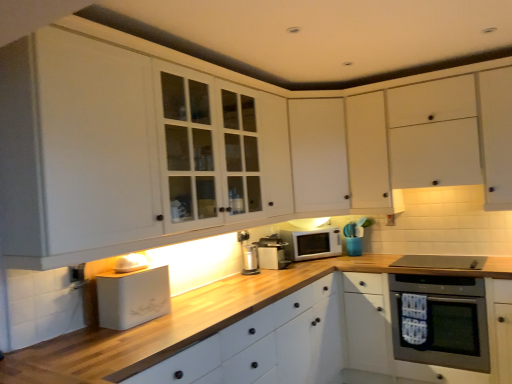
What is the approximate width of wooden at lower center?

It is 2.87 meters.

How much space does white matte cabinet at upper center, the third cabinetry in the front-to-back sequence, occupy vertically?

1.03 meters.

In the scene shown: How much space does white matte cabinet at upper right, the second cabinetry positioned from the front, occupy vertically?

white matte cabinet at upper right, the second cabinetry positioned from the front, is 3.31 feet in height.

This screenshot has width=512, height=384. Describe the element at coordinates (440, 321) in the screenshot. I see `stainless steel oven at lower right` at that location.

At what (x,y) coordinates should I click in order to perform the action: click on wooden at lower center. Please return your answer as a coordinate pair (x, y). The height and width of the screenshot is (384, 512). Looking at the image, I should click on click(x=190, y=322).

Where is `the 2nd cabinetry counting from the right of the white glossy microwave at center`? The image size is (512, 384). the 2nd cabinetry counting from the right of the white glossy microwave at center is located at coordinates (432, 137).

What's the angular difference between white matte cabinet at upper right, the 2th cabinetry when ordered from back to front, and white glossy microwave at center's facing directions?

55.6 degrees.

Which point is more forward, [482,148] or [295,232]?

Positioned in front is point [482,148].

Considering the relative sizes of white matte cabinet at upper right, the 2th cabinetry when ordered from back to front, and white glossy microwave at center in the image provided, is white matte cabinet at upper right, the 2th cabinetry when ordered from back to front, bigger than white glossy microwave at center?

Indeed, white matte cabinet at upper right, the 2th cabinetry when ordered from back to front, has a larger size compared to white glossy microwave at center.

Based on the photo, based on their sizes in the image, would you say wooden at lower center is bigger or smaller than matte gray oven at lower right?

wooden at lower center is bigger than matte gray oven at lower right.

How far apart are wooden at lower center and matte gray oven at lower right?

The distance of wooden at lower center from matte gray oven at lower right is 85.75 centimeters.

From a real-world perspective, is wooden at lower center above or below matte gray oven at lower right?

Clearly, from a real-world perspective, wooden at lower center is below matte gray oven at lower right.

From the image's perspective, which is above, wooden at lower center or matte gray oven at lower right?

matte gray oven at lower right, from the image's perspective.

From the picture: Can you confirm if stainless steel oven at lower right is positioned to the left of white matte cabinet at center, the third cabinetry when ordered from back to front?

Incorrect, stainless steel oven at lower right is not on the left side of white matte cabinet at center, the third cabinetry when ordered from back to front.

Can white matte cabinet at center, the 1th cabinetry in the front-to-back sequence, be found inside stainless steel oven at lower right?

Actually, white matte cabinet at center, the 1th cabinetry in the front-to-back sequence, is outside stainless steel oven at lower right.

Considering the relative sizes of stainless steel oven at lower right and white matte cabinet at center, the third cabinetry when ordered from back to front, in the image provided, is stainless steel oven at lower right taller than white matte cabinet at center, the third cabinetry when ordered from back to front,?

No.

Considering the points (473, 336) and (13, 124), which point is in front, point (473, 336) or point (13, 124)?

The point (13, 124) is closer.

From a real-world perspective, relative to white matte cabinet at upper right, the 2th cabinetry when ordered from back to front, is white glossy microwave at center vertically above or below?

Clearly, from a real-world perspective, white glossy microwave at center is below white matte cabinet at upper right, the 2th cabinetry when ordered from back to front.

Where is `cabinetry that is the 2nd one when counting forward from the white glossy microwave at center`? The height and width of the screenshot is (384, 512). cabinetry that is the 2nd one when counting forward from the white glossy microwave at center is located at coordinates (432, 137).

Is white glossy microwave at center next to white matte cabinet at upper right, the second cabinetry positioned from the front?

white glossy microwave at center and white matte cabinet at upper right, the second cabinetry positioned from the front, are not in contact.

Is white glossy microwave at center turned away from white matte cabinet at upper right, the 2th cabinetry when ordered from back to front?

No, white glossy microwave at center is not facing away from white matte cabinet at upper right, the 2th cabinetry when ordered from back to front.

Looking at the image, does white matte cabinet at upper center, the 1th cabinetry viewed from the back, seem bigger or smaller compared to satin silver toaster at center, the first appliance in the right-to-left sequence?

Considering their sizes, white matte cabinet at upper center, the 1th cabinetry viewed from the back, takes up more space than satin silver toaster at center, the first appliance in the right-to-left sequence.

Based on the photo, which object is wider, white matte cabinet at upper center, the 1th cabinetry viewed from the back, or satin silver toaster at center, the first appliance in the right-to-left sequence?

With larger width is white matte cabinet at upper center, the 1th cabinetry viewed from the back.

Is white matte cabinet at upper center, the third cabinetry in the front-to-back sequence, placed right next to satin silver toaster at center, the 3th appliance when ordered from left to right?

white matte cabinet at upper center, the third cabinetry in the front-to-back sequence, is not next to satin silver toaster at center, the 3th appliance when ordered from left to right, and they're not touching.

From the image's perspective, is white matte cabinet at upper right, the second cabinetry positioned from the front, above or below wooden at lower center?

Clearly, from the image's perspective, white matte cabinet at upper right, the second cabinetry positioned from the front, is above wooden at lower center.

From the picture: Is white matte cabinet at upper right, the second cabinetry positioned from the front, located outside wooden at lower center?

Yes, white matte cabinet at upper right, the second cabinetry positioned from the front, is outside of wooden at lower center.

Looking at the image, does white matte cabinet at upper right, the second cabinetry positioned from the front, seem bigger or smaller compared to wooden at lower center?

In the image, white matte cabinet at upper right, the second cabinetry positioned from the front, appears to be smaller than wooden at lower center.

In order to click on countertop that appears on the left of white matte cabinet at upper right, the second cabinetry positioned from the front in this screenshot , I will do `click(190, 322)`.

Does white glossy microwave at center lie behind satin silver thermos at lower center, the 2th appliance viewed from the left?

Yes, the depth of white glossy microwave at center is greater than that of satin silver thermos at lower center, the 2th appliance viewed from the left.

Which is more to the left, white glossy microwave at center or satin silver thermos at lower center, marked as the 2th appliance in a front-to-back arrangement?

satin silver thermos at lower center, marked as the 2th appliance in a front-to-back arrangement, is more to the left.

What's the angular difference between white glossy microwave at center and satin silver thermos at lower center, positioned as the second appliance in back-to-front order,'s facing directions?

The facing directions of white glossy microwave at center and satin silver thermos at lower center, positioned as the second appliance in back-to-front order, are 31.6 degrees apart.

There is a satin silver thermos at lower center, the 2th appliance viewed from the left. At what (x,y) coordinates should I click in order to perform the action: click on microwave oven above it (from a real-world perspective). Please return your answer as a coordinate pair (x, y). Looking at the image, I should click on (312, 244).

This screenshot has height=384, width=512. What are the coordinates of `the 3rd cabinetry above when counting from the white glossy microwave at center (from the image's perspective)` in the screenshot? It's located at (432, 137).

Where is `home appliance on the right of wooden at lower center`? home appliance on the right of wooden at lower center is located at coordinates (440, 262).

Looking at this image, which object lies further to the anchor point satin silver toaster at center, which is the third appliance from front to back, stainless steel oven at lower right or white glossy microwave at center?

stainless steel oven at lower right is further to satin silver toaster at center, which is the third appliance from front to back.

Based on their spatial positions, is white matte cabinet at center, the third cabinetry when ordered from back to front, or white matte drawer at lower center closer to stainless steel oven at lower right?

white matte drawer at lower center lies closer to stainless steel oven at lower right than the other object.

In the scene shown: When comparing their distances from satin silver toaster at center, which is the 1th appliance from back to front, does white matte bread bin at lower left, the first appliance from the left, or satin silver thermos at lower center, marked as the 2th appliance in a right-to-left arrangement, seem further?

white matte bread bin at lower left, the first appliance from the left, is positioned further to the anchor satin silver toaster at center, which is the 1th appliance from back to front.

Based on their spatial positions, is stainless steel oven at lower right or white matte drawer at lower center closer to white matte bread bin at lower left, arranged as the 1th appliance when viewed from the front?

Based on the image, white matte drawer at lower center appears to be nearer to white matte bread bin at lower left, arranged as the 1th appliance when viewed from the front.

Which object lies nearer to the anchor point white glossy microwave at center, white matte cabinet at center, the 1th cabinetry in the front-to-back sequence, or stainless steel oven at lower right?

stainless steel oven at lower right is positioned closer to the anchor white glossy microwave at center.

Based on their spatial positions, is white plastic electric outlet at lower left or matte gray oven at lower right closer to satin silver toaster at center, which is the 1th appliance from back to front?

Based on the image, matte gray oven at lower right appears to be nearer to satin silver toaster at center, which is the 1th appliance from back to front.

Considering their positions, is white matte cabinet at center, the third cabinetry when ordered from back to front, positioned closer to white matte bread bin at lower left, the first appliance from the left, than satin silver thermos at lower center, positioned as the second appliance in back-to-front order?

Based on the image, white matte cabinet at center, the third cabinetry when ordered from back to front, appears to be nearer to white matte bread bin at lower left, the first appliance from the left.

Based on their spatial positions, is white plastic electric outlet at lower left or satin silver thermos at lower center, marked as the 2th appliance in a right-to-left arrangement, further from white matte cabinet at center, the 1th cabinetry in the front-to-back sequence?

white plastic electric outlet at lower left is positioned further to the anchor white matte cabinet at center, the 1th cabinetry in the front-to-back sequence.

At what (x,y) coordinates should I click in order to perform the action: click on appliance between satin silver thermos at lower center, the 2th appliance viewed from the left, and stainless steel oven at lower right from left to right. Please return your answer as a coordinate pair (x, y). The height and width of the screenshot is (384, 512). Looking at the image, I should click on (272, 252).

At what (x,y) coordinates should I click in order to perform the action: click on countertop located between white plastic electric outlet at lower left and matte gray oven at lower right in the left-right direction. Please return your answer as a coordinate pair (x, y). This screenshot has width=512, height=384. Looking at the image, I should click on (190, 322).

Where is `appliance situated between satin silver thermos at lower center, marked as the 2th appliance in a front-to-back arrangement, and matte gray oven at lower right from left to right`? appliance situated between satin silver thermos at lower center, marked as the 2th appliance in a front-to-back arrangement, and matte gray oven at lower right from left to right is located at coordinates (272, 252).

Locate an element on the screen. The height and width of the screenshot is (384, 512). drawer between white matte bread bin at lower left, arranged as the 1th appliance when viewed from the front, and matte gray oven at lower right, in the horizontal direction is located at coordinates (234, 337).